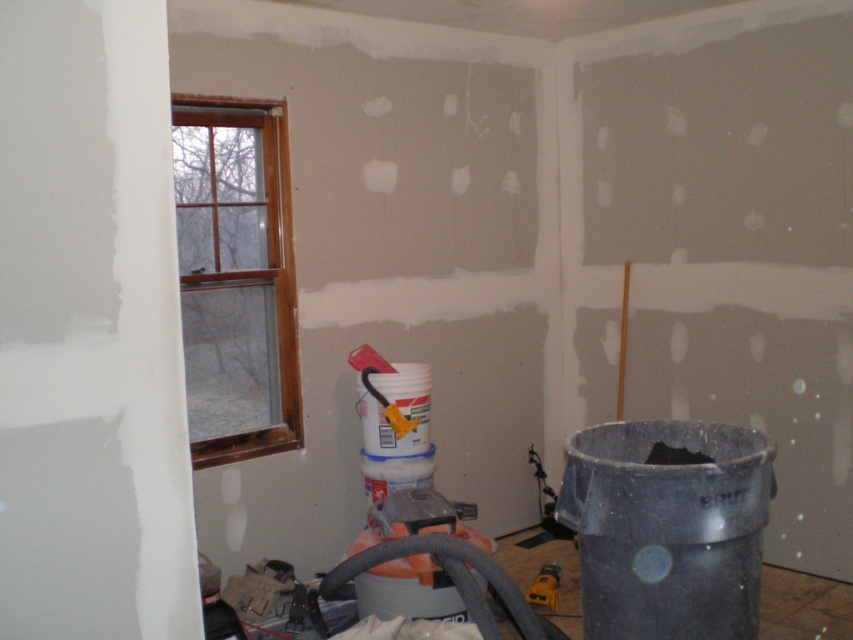
Can you confirm if brown wooden window at upper left is positioned to the left of yellow plastic tool at lower center?

Indeed, brown wooden window at upper left is positioned on the left side of yellow plastic tool at lower center.

Is brown wooden window at upper left closer to the viewer compared to yellow plastic tool at lower center?

Yes, it is.

Between point (247, 148) and point (537, 595), which one is positioned in front?

Point (537, 595) is more forward.

At what (x,y) coordinates should I click in order to perform the action: click on brown wooden window at upper left. Please return your answer as a coordinate pair (x, y). The image size is (853, 640). Looking at the image, I should click on (236, 276).